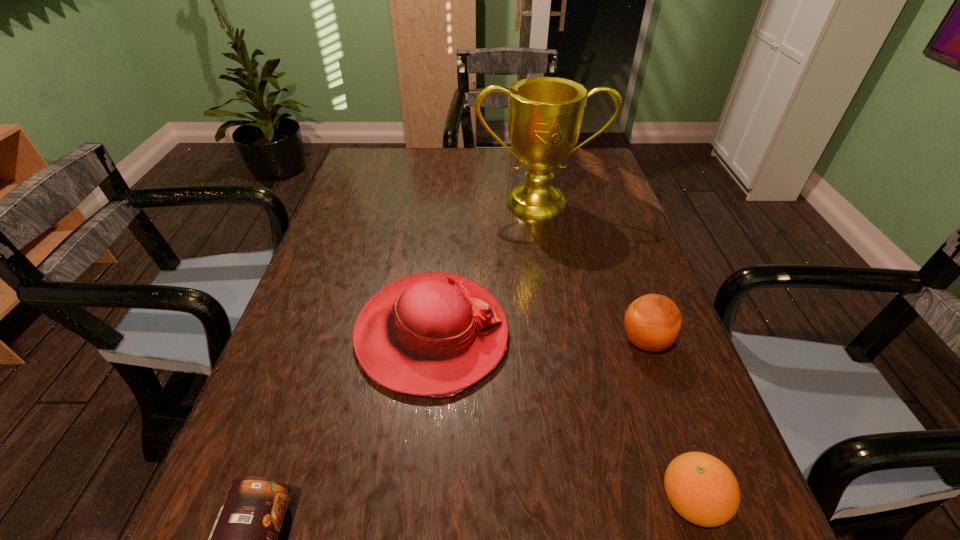
Identify the location of object located in the left edge section of the desktop. (433, 334).

I want to click on award situated at the right edge, so click(545, 114).

Locate an element on the screen. object located in the near right corner section of the desktop is located at coordinates (702, 489).

Where is `free space at the far edge of the desktop`? The height and width of the screenshot is (540, 960). free space at the far edge of the desktop is located at coordinates (483, 151).

What are the coordinates of `vacant space at the left edge of the desktop` in the screenshot? It's located at (209, 502).

You are a GUI agent. You are given a task and a screenshot of the screen. Output one action in this format:
    pyautogui.click(x=<x>, y=<y>)
    Task: Click on the blank area at the right edge
    This screenshot has width=960, height=540.
    Given the screenshot: What is the action you would take?
    pyautogui.click(x=642, y=291)

In the image, there is a desktop. At what (x,y) coordinates should I click in order to perform the action: click on free space at the far left corner. Please return your answer as a coordinate pair (x, y). This screenshot has height=540, width=960. Looking at the image, I should click on (362, 171).

I want to click on vacant space at the far right corner of the desktop, so click(587, 154).

The height and width of the screenshot is (540, 960). I want to click on free space between the hat and the farther orange, so click(x=539, y=338).

I want to click on vacant space in between the shorter orange and the taller orange, so click(x=668, y=421).